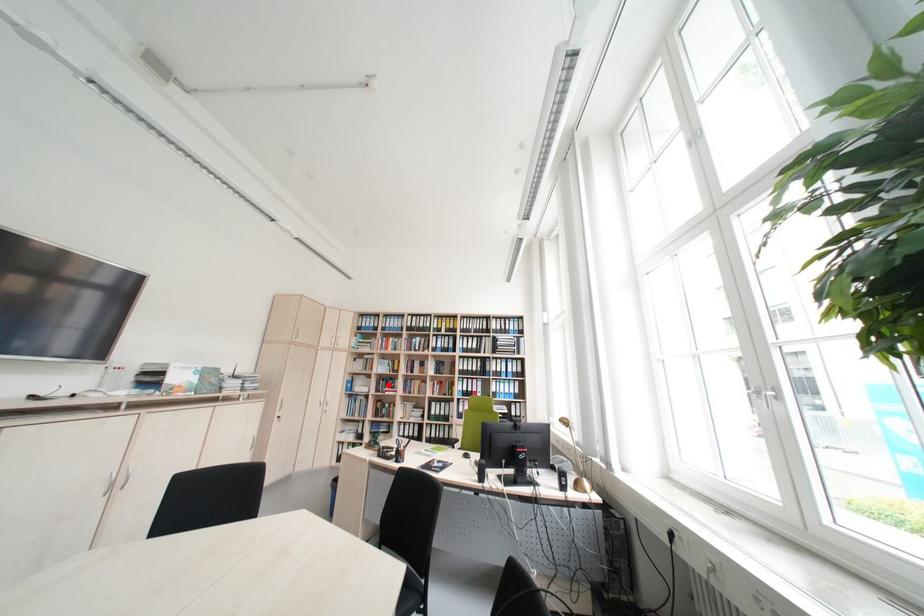
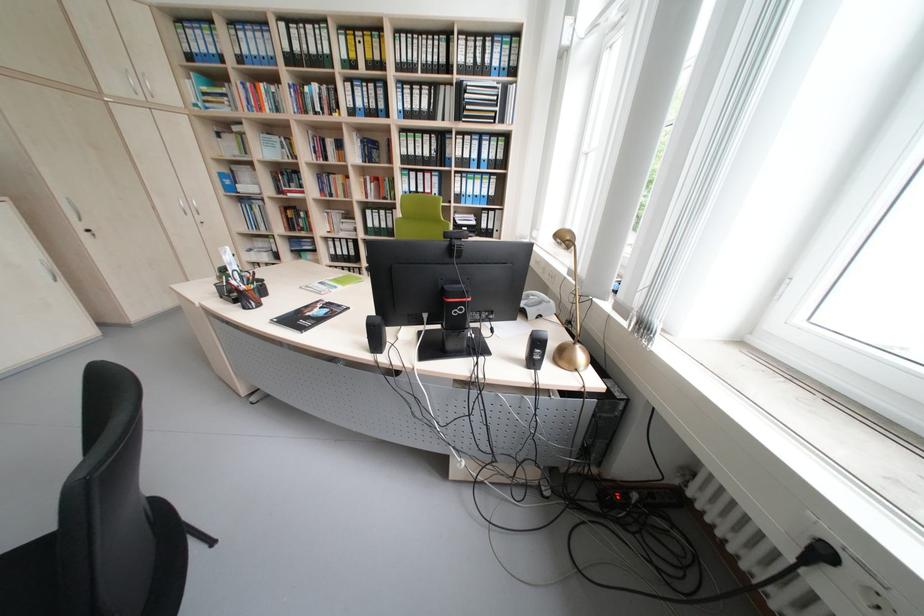
Find the pixel in the second image that matches the highlighted location in the first image.

(286, 182)